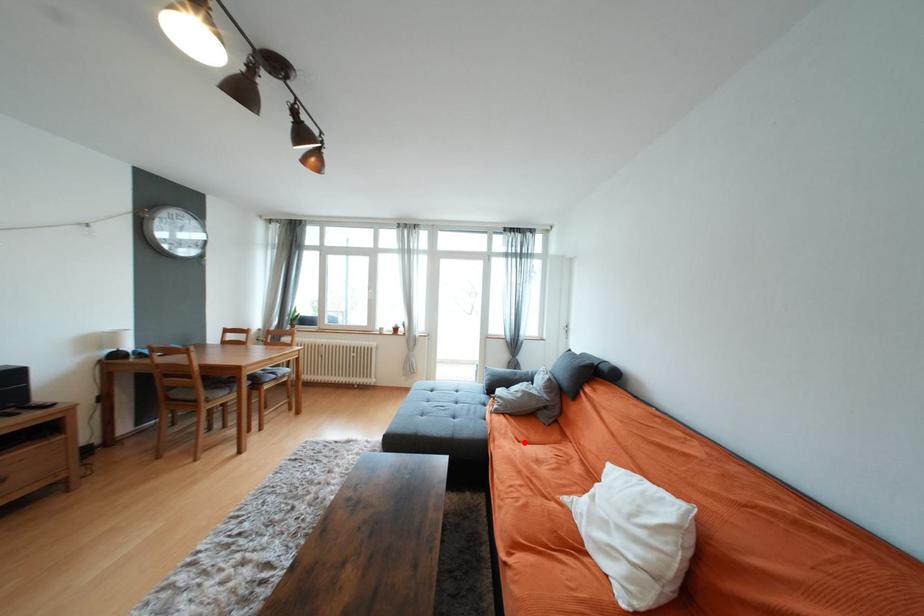
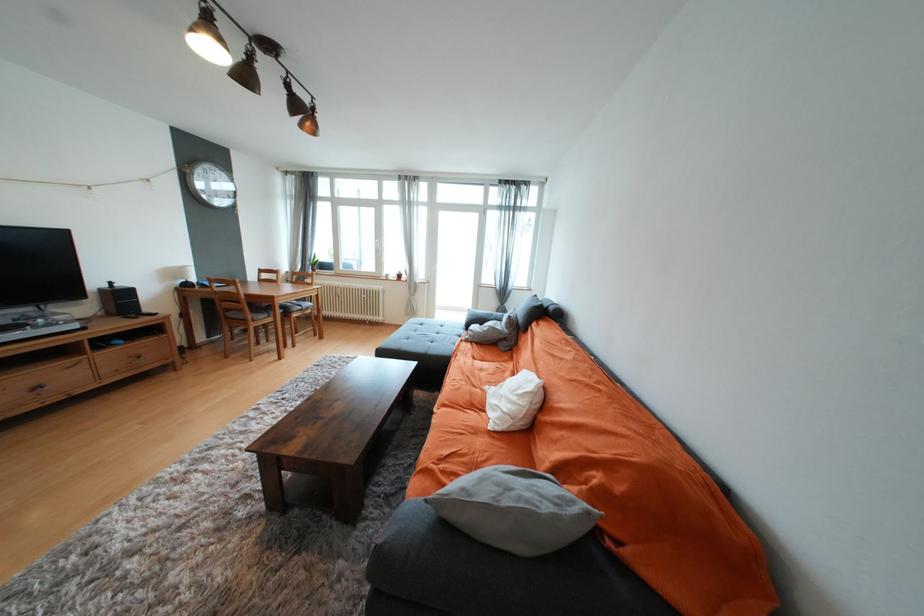
The point at the highlighted location is marked in the first image. Where is the corresponding point in the second image?

(480, 360)